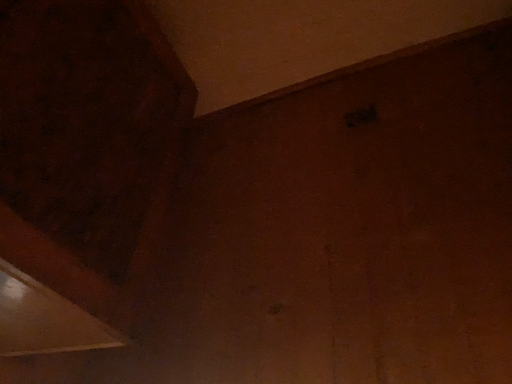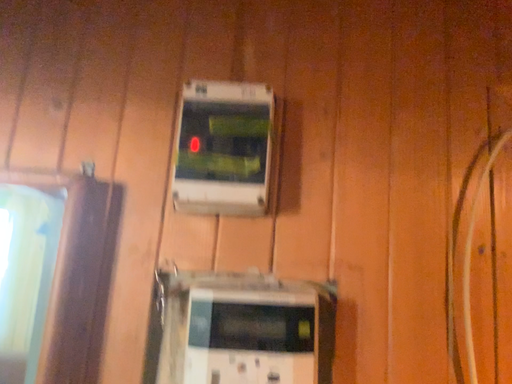
Question: Which way did the camera rotate in the video?

Choices:
 (A) rotated downward
 (B) rotated upward

Answer: (A)